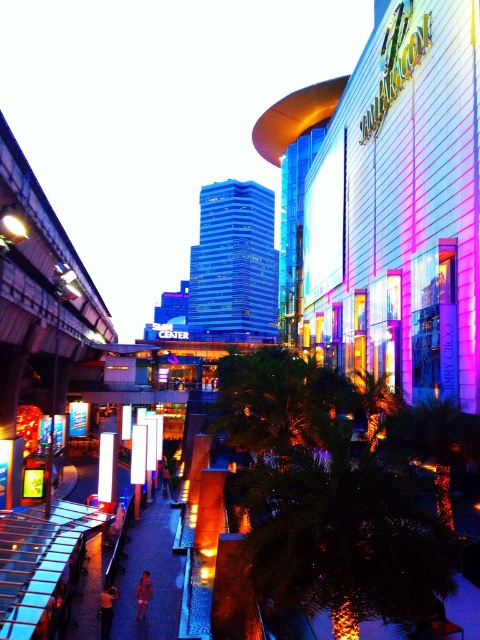
Question: Is orange fabric shirt at lower left wider than pink fabric person at center?

Choices:
 (A) yes
 (B) no

Answer: (A)

Question: Among these objects, which one is farthest from the camera?

Choices:
 (A) pink fabric person at center
 (B) orange fabric shirt at lower left

Answer: (A)

Question: Observing the image, what is the correct spatial positioning of orange fabric shirt at lower left in reference to pink fabric person at center?

Choices:
 (A) above
 (B) below

Answer: (A)

Question: Does orange fabric shirt at lower left have a greater width compared to pink fabric person at center?

Choices:
 (A) no
 (B) yes

Answer: (B)